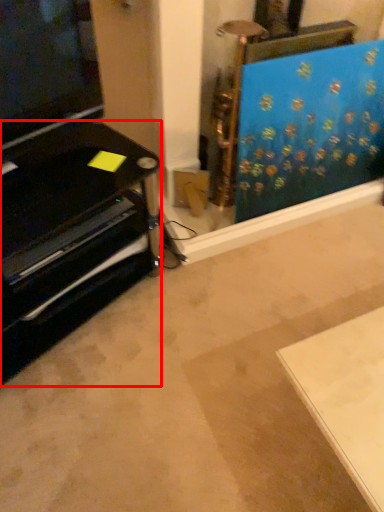
Question: Where is furniture (annotated by the red box) located in relation to curtain in the image?

Choices:
 (A) left
 (B) right

Answer: (A)